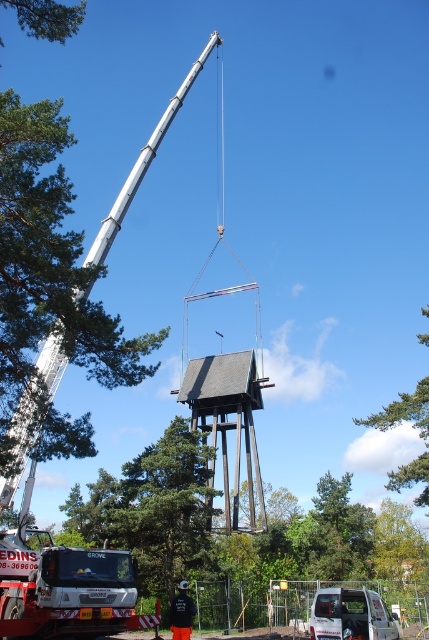
Question: Which point is closer to the camera?

Choices:
 (A) silver metallic crane at upper left
 (B) green leafy tree at upper center
 (C) white matte van at center
 (D) green leafy tree at upper left

Answer: (C)

Question: Which of the following is the closest to the observer?

Choices:
 (A) (395, 470)
 (B) (395, 525)
 (C) (356, 609)

Answer: (C)

Question: Considering the relative positions of silver metallic crane at upper left and green leafy tree at upper center in the image provided, where is silver metallic crane at upper left located with respect to green leafy tree at upper center?

Choices:
 (A) above
 (B) below

Answer: (A)

Question: In this image, where is gray wooden tower at center located relative to green leafy tree at center?

Choices:
 (A) left
 (B) right

Answer: (A)

Question: Which point is closer to the camera?

Choices:
 (A) silver metallic crane at upper left
 (B) green leafy tree at upper center
 (C) green leafy tree at upper left

Answer: (A)

Question: Is silver metallic crane at upper left to the right of green leafy tree at upper center from the viewer's perspective?

Choices:
 (A) no
 (B) yes

Answer: (A)